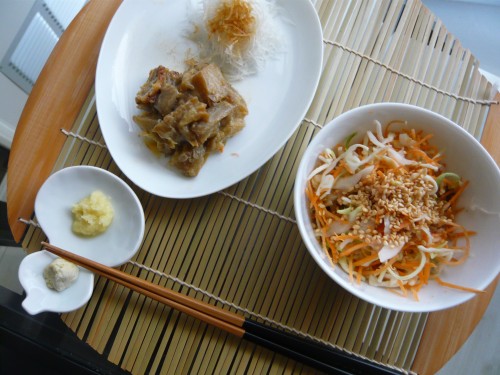
Locate an element on the screen. The height and width of the screenshot is (375, 500). butternut shaped plate is located at coordinates (128, 244).